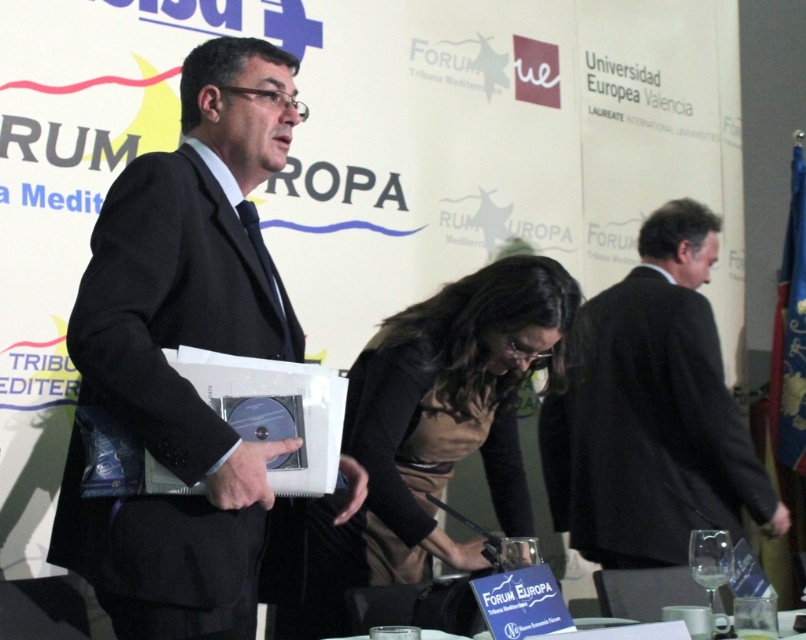
Does matte black suit at center have a greater width compared to brown fabric dress at center?

No.

In the scene shown: Does matte black suit at center appear over brown fabric dress at center?

Correct, matte black suit at center is located above brown fabric dress at center.

Where is `matte black suit at center`? matte black suit at center is located at coordinates (187, 344).

This screenshot has width=806, height=640. What are the coordinates of `matte black suit at center` in the screenshot? It's located at (187, 344).

Does matte black suit at center have a greater height compared to black suit at center?

No.

The width and height of the screenshot is (806, 640). Find the location of `matte black suit at center`. matte black suit at center is located at coordinates (187, 344).

The image size is (806, 640). I want to click on matte black suit at center, so click(x=187, y=344).

How much distance is there between black suit at center and brown fabric dress at center?

They are 27.55 inches apart.

Looking at this image, does black suit at center have a smaller size compared to brown fabric dress at center?

No.

In order to click on black suit at center in this screenshot , I will do `click(651, 412)`.

Locate an element on the screen. black suit at center is located at coordinates (651, 412).